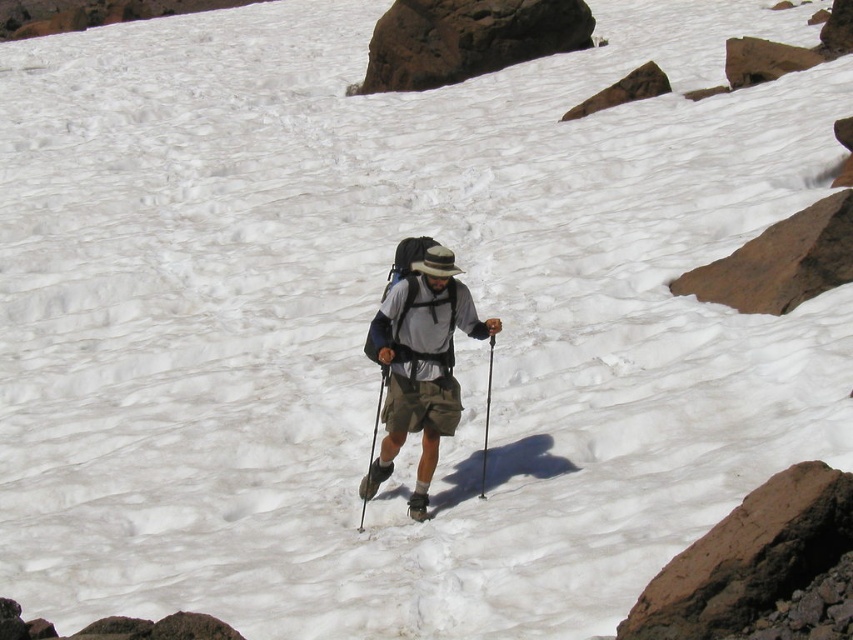
You are the hiker in the image. You need to place your trekking pole between the brown rough rock at upper center and the brown rock at upper right. Which rock should you place it closer to if you want the pole to be closer to the wider rock?

You should place the trekking pole closer to the brown rough rock at upper center because it might be wider than the brown rock at upper right.